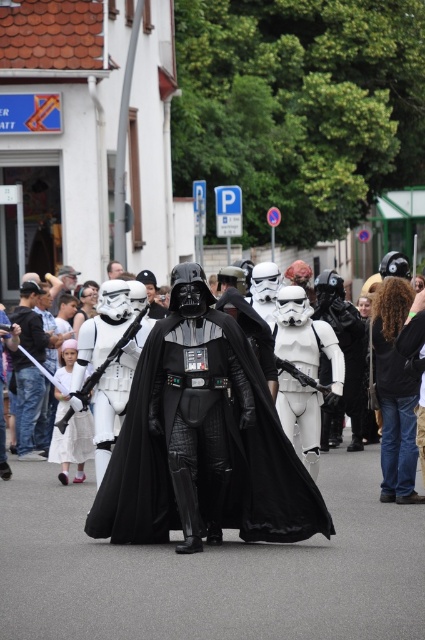
How much distance is there between shiny black cape at center and black matte helmet at center?

A distance of 11.09 meters exists between shiny black cape at center and black matte helmet at center.

Can you confirm if shiny black cape at center is positioned to the left of black matte helmet at center?

In fact, shiny black cape at center is to the right of black matte helmet at center.

Which is in front, point (118, 515) or point (112, 276)?

Point (118, 515)

Identify the location of shiny black cape at center. (203, 449).

The width and height of the screenshot is (425, 640). Describe the element at coordinates (203, 449) in the screenshot. I see `shiny black cape at center` at that location.

Who is lower down, shiny black cape at center or matte black helmet at center?

shiny black cape at center

Does point (235, 515) come farther from viewer compared to point (19, 412)?

No, (235, 515) is in front of (19, 412).

Where is `shiny black cape at center`? This screenshot has height=640, width=425. shiny black cape at center is located at coordinates (203, 449).

Between matte black helmet at center and black matte helmet at center, which one is positioned lower?

matte black helmet at center is below.

Where is `matte black helmet at center`? matte black helmet at center is located at coordinates (27, 404).

Which is behind, point (25, 394) or point (112, 276)?

The point (112, 276) is more distant.

I want to click on matte black helmet at center, so click(x=27, y=404).